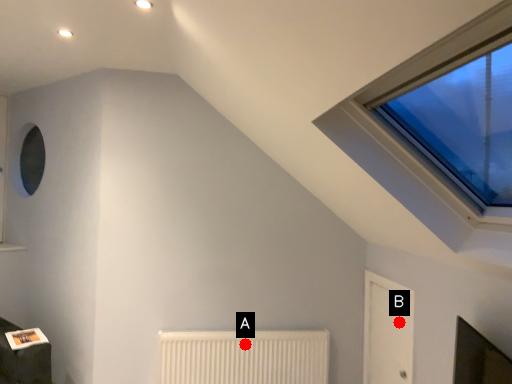
Question: Two points are circled on the image, labeled by A and B beside each circle. Which of the following is the farthest from the observer?

Choices:
 (A) A is further
 (B) B is further

Answer: (A)